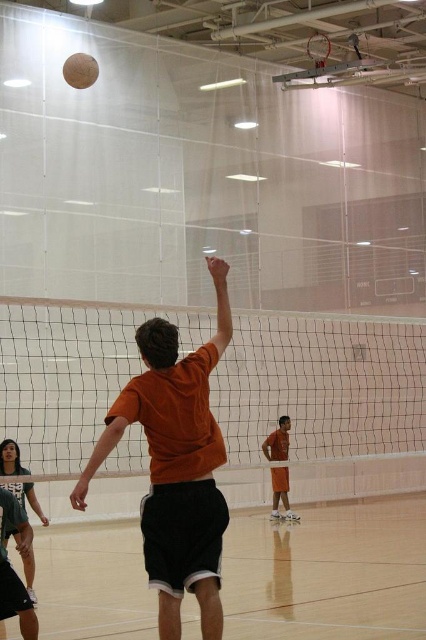
You are a volleyball coach observing the game and want to place two markers on the court at the positions of point [75,314] and point [9,472]. Which point is closer to the net?

Point [9,472] is closer to the net because it is further away from the viewer compared to point [75,314], which is closer to the viewer and therefore farther from the net.

From the picture: You are a volleyball player standing on the wooden floor at center. You want to kick the matte black shorts at lower left. Can you reach them without moving your feet?

The wooden floor at center is in front of the matte black shorts at lower left, meaning the shorts are behind you. Since you can only kick forward, you cannot reach them without moving your feet.